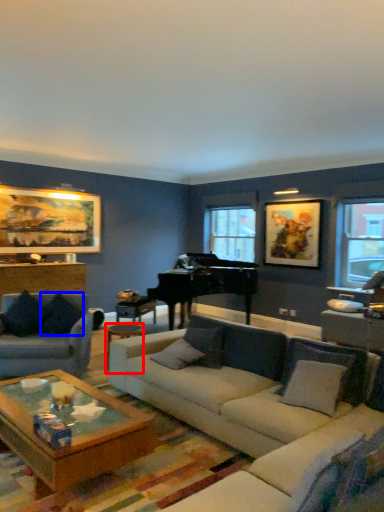
Question: Among these objects, which one is nearest to the camera, side table (highlighted by a red box) or pillow (highlighted by a blue box)?

Choices:
 (A) side table
 (B) pillow

Answer: (A)